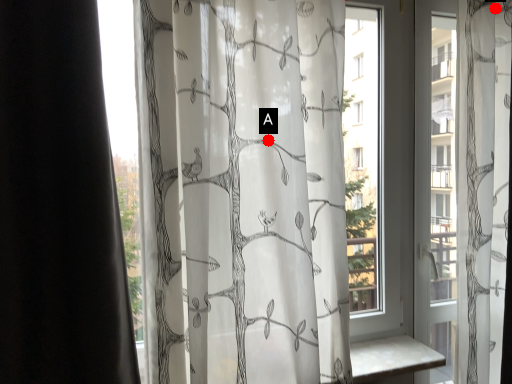
Question: Two points are circled on the image, labeled by A and B beside each circle. Which of the following is the farthest from the observer?

Choices:
 (A) A is further
 (B) B is further

Answer: (B)